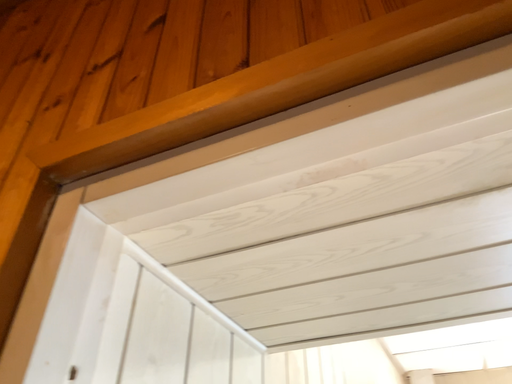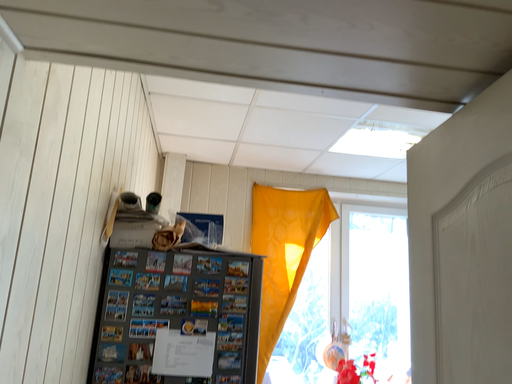
Question: Which way did the camera rotate in the video?

Choices:
 (A) rotated downward
 (B) rotated upward

Answer: (A)